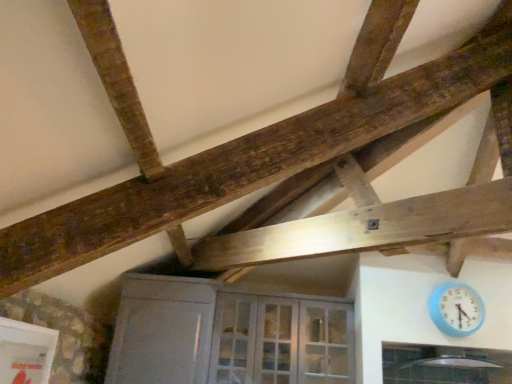
Question: Can you confirm if white glass door at center is positioned to the right of clear glass window at lower center?

Choices:
 (A) no
 (B) yes

Answer: (A)

Question: Can you confirm if white glass door at center is smaller than clear glass window at lower center?

Choices:
 (A) no
 (B) yes

Answer: (A)

Question: Is white glass door at center not near clear glass window at lower center?

Choices:
 (A) no
 (B) yes

Answer: (A)

Question: Does white glass door at center come behind clear glass window at lower center?

Choices:
 (A) no
 (B) yes

Answer: (B)

Question: Is white glass door at center in contact with clear glass window at lower center?

Choices:
 (A) yes
 (B) no

Answer: (B)

Question: Is white glass door at center outside clear glass window at lower center?

Choices:
 (A) yes
 (B) no

Answer: (A)

Question: Is blue plastic wall clock at lower right not within white glass door at center?

Choices:
 (A) no
 (B) yes

Answer: (B)

Question: Does blue plastic wall clock at lower right have a larger size compared to white glass door at center?

Choices:
 (A) no
 (B) yes

Answer: (A)

Question: Is blue plastic wall clock at lower right at the right side of white glass door at center?

Choices:
 (A) yes
 (B) no

Answer: (A)

Question: From a real-world perspective, does blue plastic wall clock at lower right sit lower than white glass door at center?

Choices:
 (A) yes
 (B) no

Answer: (B)

Question: Is blue plastic wall clock at lower right aimed at white glass door at center?

Choices:
 (A) yes
 (B) no

Answer: (B)

Question: From the image's perspective, is blue plastic wall clock at lower right on top of white glass door at center?

Choices:
 (A) no
 (B) yes

Answer: (B)

Question: Is clear glass window at lower center at the left side of white glass door at center?

Choices:
 (A) yes
 (B) no

Answer: (B)